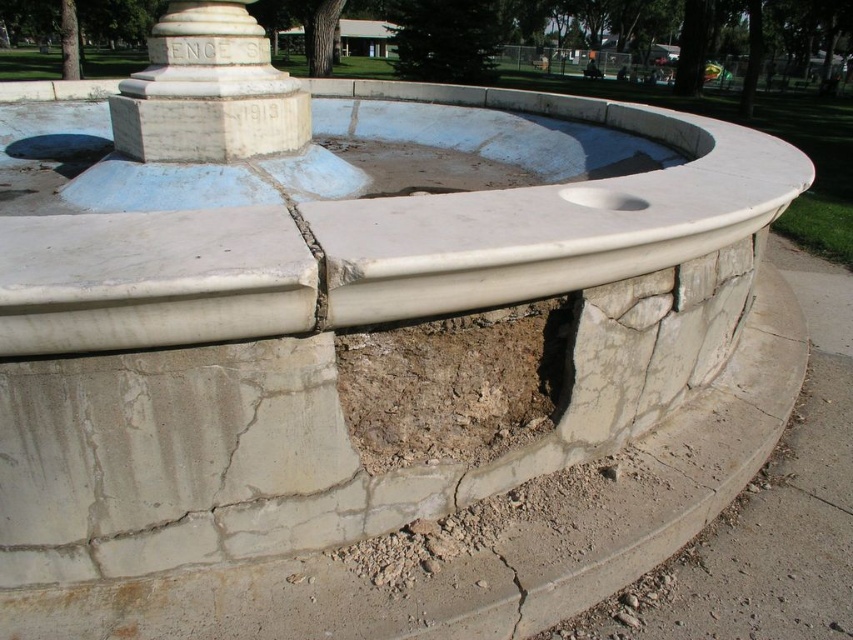
Question: Does white stone column at center lie in front of smooth concrete hole at center?

Choices:
 (A) no
 (B) yes

Answer: (A)

Question: Which object is farther from the camera taking this photo?

Choices:
 (A) smooth concrete hole at center
 (B) white stone column at center
 (C) brown dirt hole at center
 (D) cracked concrete at lower center

Answer: (C)

Question: Which of the following is the closest to the observer?

Choices:
 (A) (247, 99)
 (B) (480, 616)
 (C) (596, 204)
 (D) (399, 193)

Answer: (B)

Question: Observing the image, what is the correct spatial positioning of white stone column at center in reference to cracked concrete at lower center?

Choices:
 (A) right
 (B) left

Answer: (B)

Question: Considering the relative positions of white stone column at center and cracked concrete at lower center in the image provided, where is white stone column at center located with respect to cracked concrete at lower center?

Choices:
 (A) left
 (B) right

Answer: (A)

Question: Which of the following is the farthest from the observer?

Choices:
 (A) white stone column at center
 (B) cracked concrete at lower center
 (C) smooth concrete hole at center
 (D) brown dirt hole at center

Answer: (D)